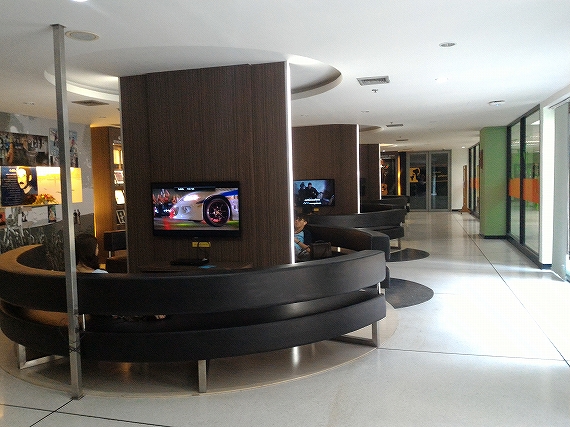
Where is `glass doors along back wall`? This screenshot has width=570, height=427. glass doors along back wall is located at coordinates (439, 164), (439, 187), (418, 164), (422, 192).